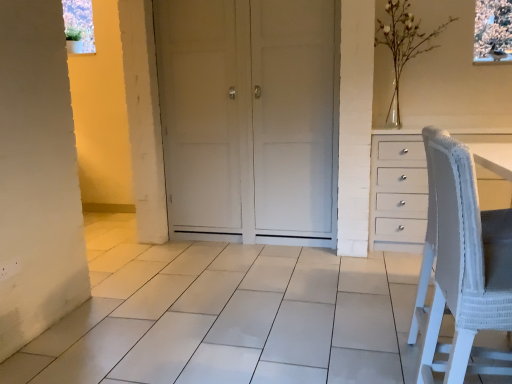
Question: From a real-world perspective, is white glass vase at upper right physically located above or below white matte door at center?

Choices:
 (A) below
 (B) above

Answer: (B)

Question: From the image's perspective, is white glass vase at upper right located above or below white matte door at center?

Choices:
 (A) below
 (B) above

Answer: (B)

Question: Which object is positioned closest to the white woven fabric chair at right?

Choices:
 (A) white glass vase at upper right
 (B) white matte door at center

Answer: (B)

Question: Considering the real-world distances, which object is closest to the white woven fabric chair at right?

Choices:
 (A) white matte door at center
 (B) white glass vase at upper right

Answer: (A)